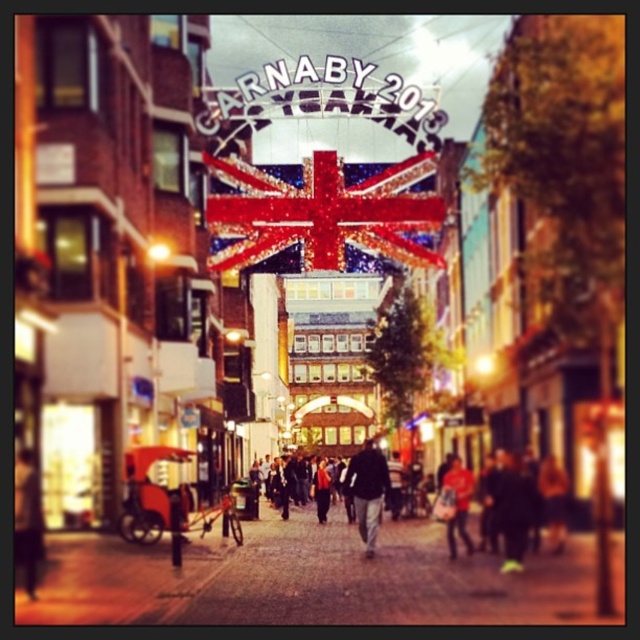
Looking at this image, you are a photographer standing on Carnaby Street in London, and you want to capture a photo that includes both the shiny fabric flag at center and the red fabric jacket at center. Which object should you focus on first if you want to ensure both are in frame without moving the camera?

The shiny fabric flag at center is taller than the red fabric jacket at center, so you should focus on the shiny fabric flag at center first to ensure its full height is captured in the frame while still including the red fabric jacket at center.

You are a photographer standing on Carnaby Street, London, during the festive season. You notice two jackets displayed in the center of the street scene. Which jacket, the dark gray jacket at center or the red fabric jacket at center, is taller?

The dark gray jacket at center is taller than the red fabric jacket at center.